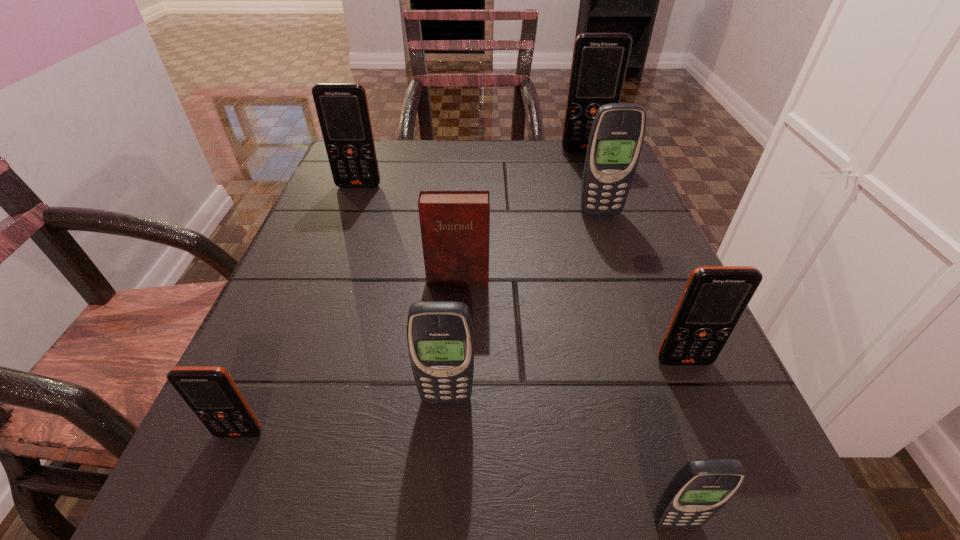
Where is `free space located 0.140m on the screen of the second nearest orange cellular telephone`? This screenshot has width=960, height=540. free space located 0.140m on the screen of the second nearest orange cellular telephone is located at coordinates (726, 464).

Locate an element on the screen. The height and width of the screenshot is (540, 960). free spot located 0.140m on the front cover of the diary is located at coordinates pos(453,352).

Where is `free spot located on the screen of the nearest orange cellular telephone`? The height and width of the screenshot is (540, 960). free spot located on the screen of the nearest orange cellular telephone is located at coordinates (208, 507).

You are a GUI agent. You are given a task and a screenshot of the screen. Output one action in this format:
    pyautogui.click(x=<x>, y=<y>)
    Task: Click on the object positioned at the near edge
    Image resolution: width=960 pixels, height=540 pixels.
    Given the screenshot: What is the action you would take?
    pyautogui.click(x=701, y=488)

I want to click on object that is at the far left corner, so click(342, 108).

This screenshot has width=960, height=540. What are the coordinates of `object positioned at the far right corner` in the screenshot? It's located at click(x=599, y=63).

This screenshot has height=540, width=960. I want to click on object at the near right corner, so click(701, 488).

The image size is (960, 540). Find the location of `vacant space at the far edge of the desktop`. vacant space at the far edge of the desktop is located at coordinates (481, 149).

At what (x,y) coordinates should I click in order to perform the action: click on blank area at the near edge. Please return your answer as a coordinate pair (x, y). The width and height of the screenshot is (960, 540). Looking at the image, I should click on (597, 475).

Image resolution: width=960 pixels, height=540 pixels. In the image, there is a desktop. In order to click on vacant space at the left edge in this screenshot , I will do `click(345, 232)`.